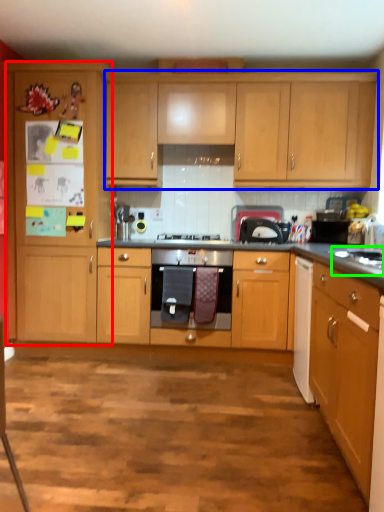
Question: Which object is positioned farthest from cabinetry (highlighted by a red box)? Select from cabinetry (highlighted by a blue box) and sink (highlighted by a green box).

Choices:
 (A) cabinetry
 (B) sink

Answer: (B)